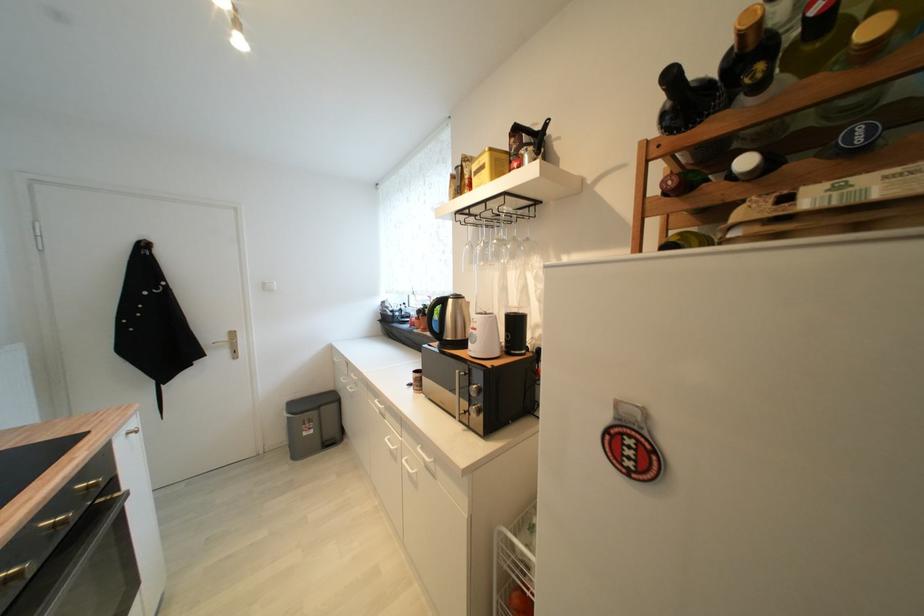
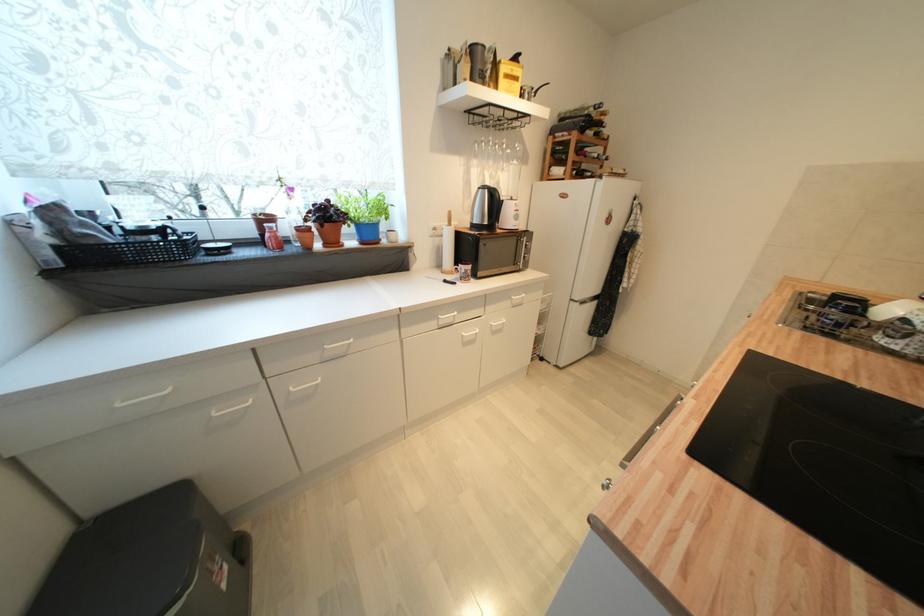
Locate, in the second image, the point that corresponds to pixel 310 436 in the first image.

(228, 588)